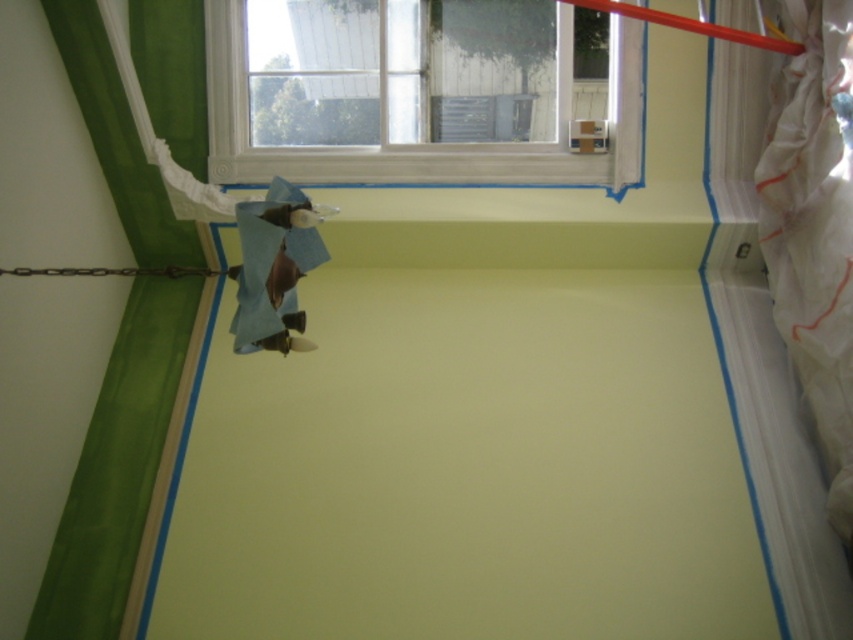
You are standing in the room and want to open the white painted wood window at upper center. To do so, you need to move the white plastic curtain at right first. Is the curtain blocking the window?

The white painted wood window at upper center is to the left of the white plastic curtain at right, so the curtain is not blocking the window. You can open the window without moving the curtain.

You are standing in the room and want to look outside through the white painted wood window at upper center. Is the white plastic curtain at right blocking your view?

The white painted wood window at upper center is positioned over the white plastic curtain at right, so the curtain is below the window and does not block the view.